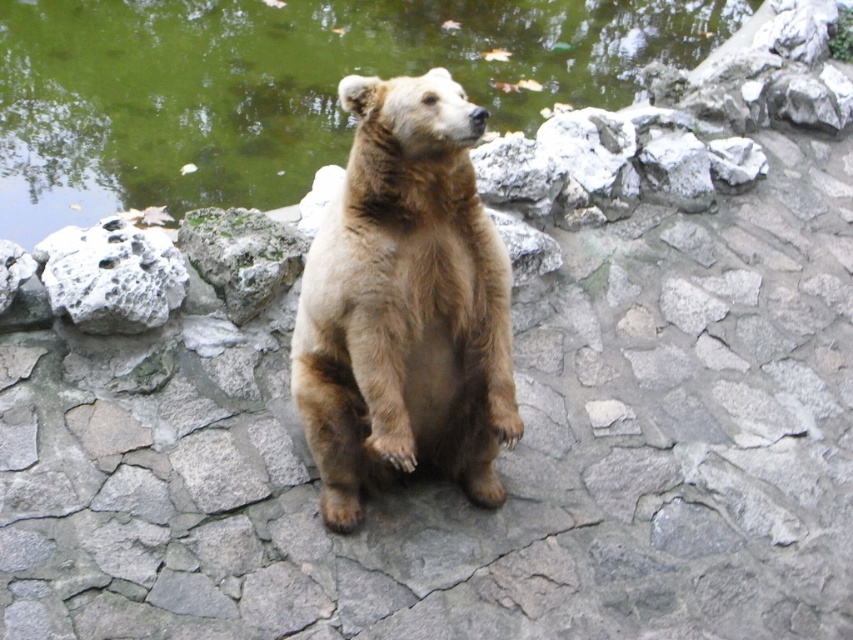
You are a hiker who wants to cross the area where the brown furry bear at center is standing. The green water at upper center is flowing towards you. Is the path to cross safe? Please explain based on the bear and water positions.

The green water at upper center is located above the brown furry bear at center, meaning the water is flowing towards the bear and away from your path. The bear is on the stone surface, so the path should be safe to cross as long as you avoid disturbing the bear.

You are standing at the camera position and want to throw a rock to hit a target located at point (247, 188). What is the minimum distance you need to throw the rock to reach that point?

The minimum distance you need to throw the rock to reach point (247, 188) is 4.57 meters, as that is the distance from the camera to the point.

You are a photographer trying to capture the brown bear in the image. You notice two points marked in the scene. The first point is at coordinates point (138, 122) and the second point is at point (160, 248). Which point is closer to your camera lens?

Point (138, 122) is closer to the camera lens since it is further to the viewer compared to point (160, 248).